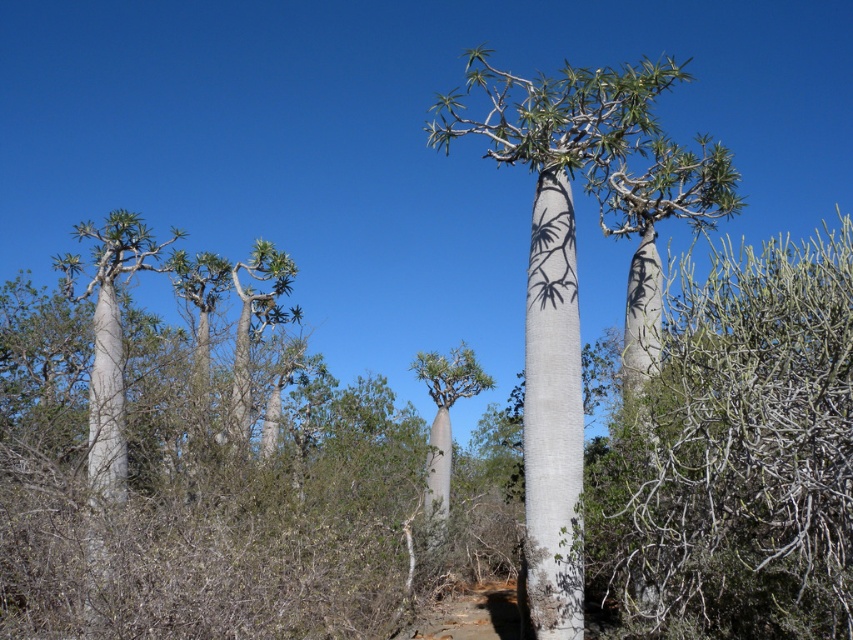
Is white smooth baobab tree at center behind green leafy tree at center?

No.

Which is in front, point (624, 355) or point (440, 500)?

Positioned in front is point (624, 355).

Where is `white smooth baobab tree at center`? The width and height of the screenshot is (853, 640). white smooth baobab tree at center is located at coordinates (x=575, y=264).

Measure the distance between point (653, 493) and camera.

Point (653, 493) is 8.09 meters from camera.

Who is positioned more to the right, white bark tree at center or green leafy tree at center?

Positioned to the right is white bark tree at center.

Which is behind, point (827, 412) or point (468, 380)?

Positioned behind is point (468, 380).

The width and height of the screenshot is (853, 640). In order to click on white bark tree at center in this screenshot , I will do `click(735, 454)`.

Does white bark tree at center have a smaller size compared to white smooth baobab tree at center?

Yes, white bark tree at center is smaller than white smooth baobab tree at center.

The height and width of the screenshot is (640, 853). What do you see at coordinates (735, 454) in the screenshot?
I see `white bark tree at center` at bounding box center [735, 454].

Locate an element on the screen. white bark tree at center is located at coordinates (735, 454).